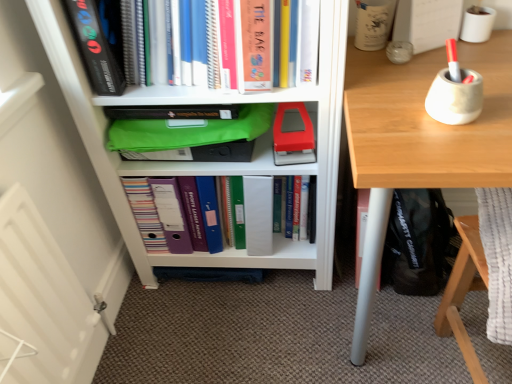
This screenshot has height=384, width=512. In order to click on free space in front of matte gray pen holder at upper right, which is the 3th stationery from left to right in this screenshot , I will do `click(460, 153)`.